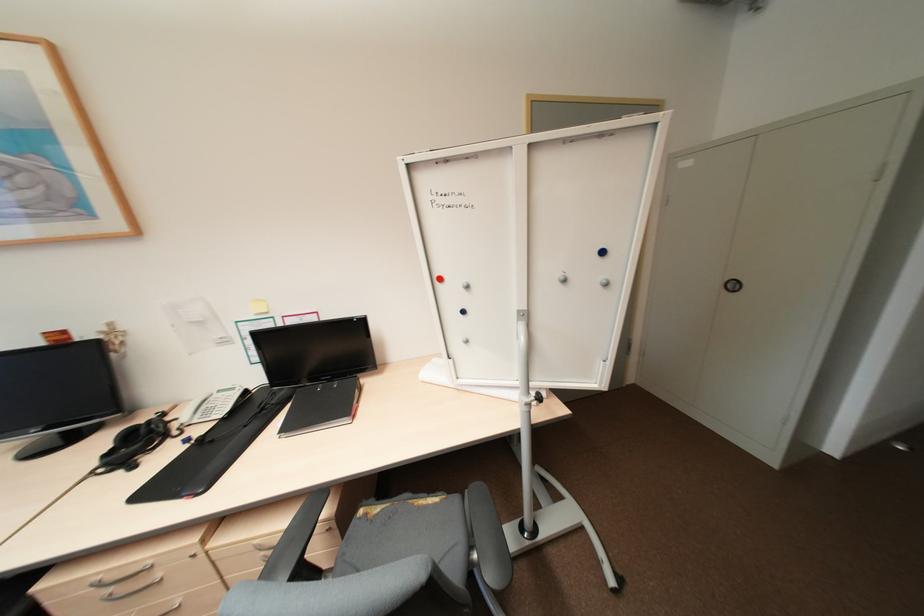
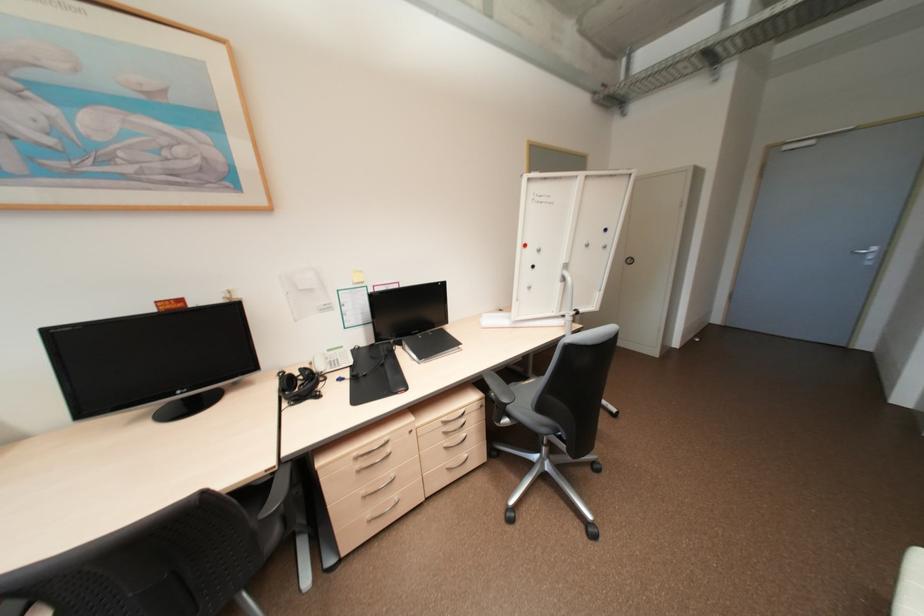
In the scene shown: What movement of the cameraman would produce the second image?

The movement direction of the cameraman is left, backward.